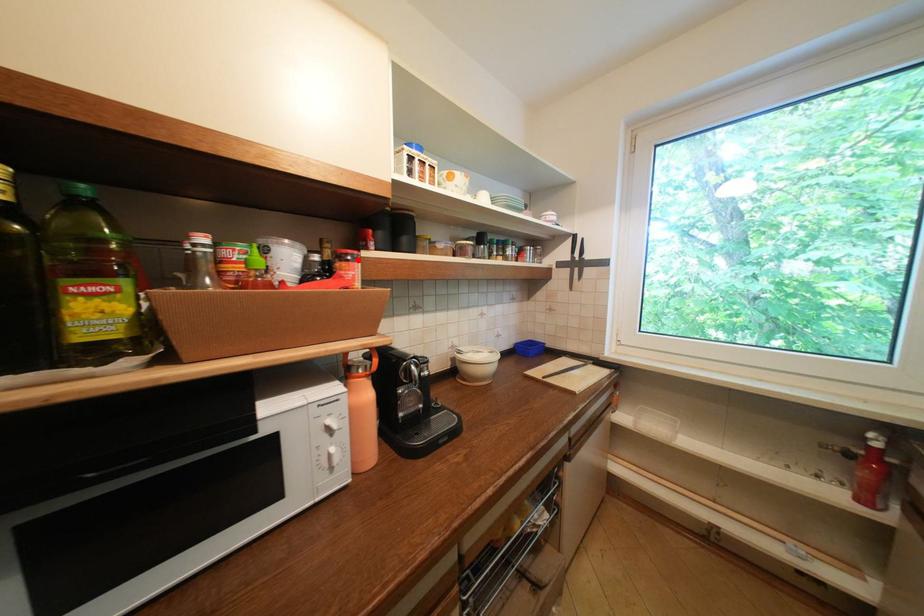
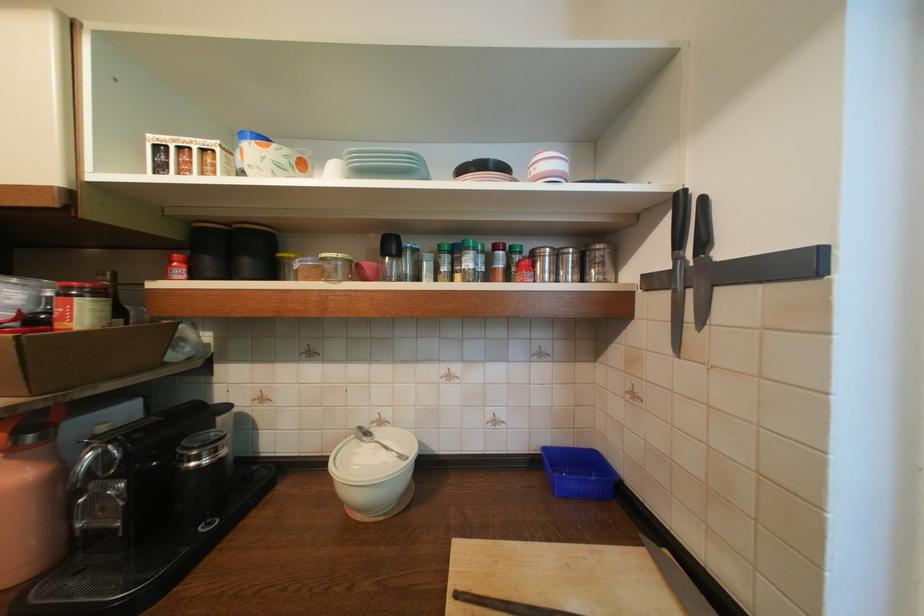
Locate, in the second image, the point that corresponds to the highlighted location in the first image.

(82, 294)